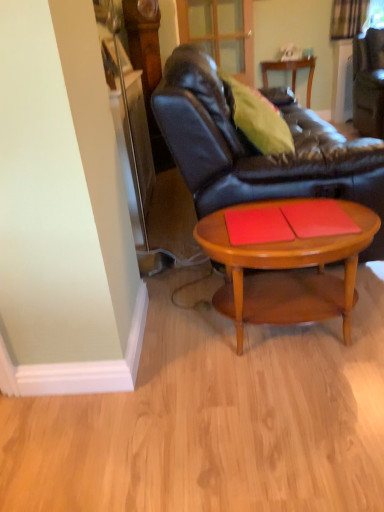
Question: Would you say leather couch at center is to the left or to the right of red matte placemat at center, the first plank from the right, in the picture?

Choices:
 (A) right
 (B) left

Answer: (B)

Question: Is point (299, 157) closer or farther from the camera than point (302, 209)?

Choices:
 (A) closer
 (B) farther

Answer: (B)

Question: Which object is positioned closest to the wooden table at center?

Choices:
 (A) leather couch at center
 (B) red matte book at center, which ranks as the 2th plank in right-to-left order
 (C) red matte placemat at center, the first plank from the right
 (D) light brown wood coffee table at center

Answer: (A)

Question: Based on their relative distances, which object is nearer to the red matte placemat at center, the second plank viewed from the left?

Choices:
 (A) red matte book at center, the first plank when ordered from left to right
 (B) leather couch at center
 (C) wooden table at center
 (D) light brown wood coffee table at center

Answer: (A)